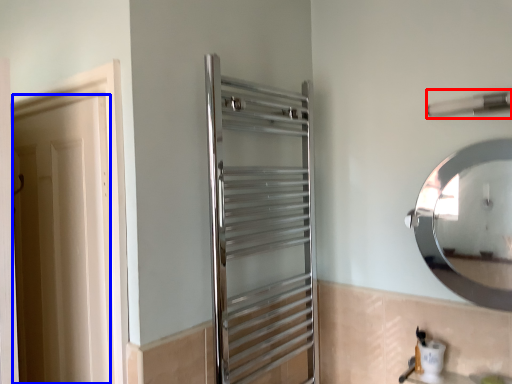
Question: Which object is further to the camera taking this photo, towel bar (highlighted by a red box) or door (highlighted by a blue box)?

Choices:
 (A) towel bar
 (B) door

Answer: (B)